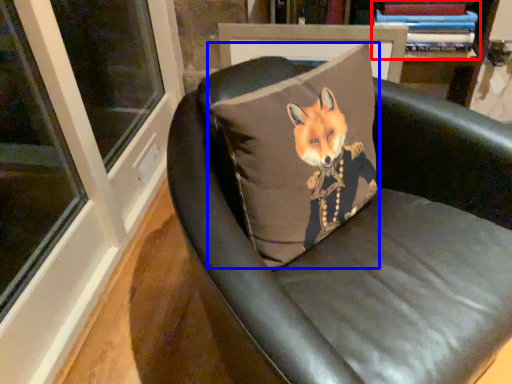
Question: Which point is closer to the camera, book (highlighted by a red box) or pillow (highlighted by a blue box)?

Choices:
 (A) book
 (B) pillow

Answer: (B)